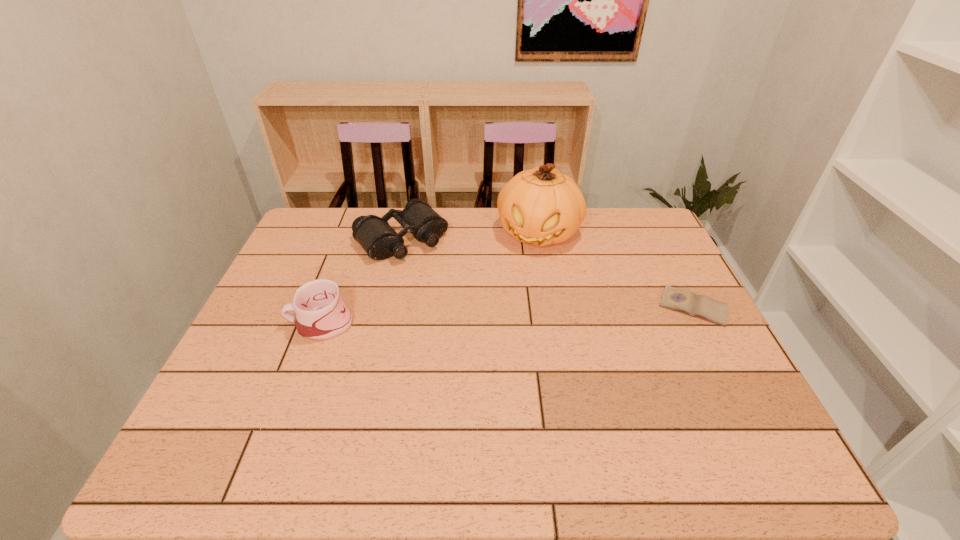
Identify the location of vacant space located on the front face of the pumpkin. (512, 314).

Locate an element on the screen. free space located on the front face of the pumpkin is located at coordinates (525, 272).

Locate an element on the screen. The image size is (960, 540). free space located on the front face of the pumpkin is located at coordinates (525, 272).

Find the location of a particular element. This screenshot has height=540, width=960. binoculars at the far edge is located at coordinates (380, 241).

Identify the location of pumpkin positioned at the far edge. (540, 206).

Find the location of a particular element. This screenshot has width=960, height=540. object positioned at the left edge is located at coordinates (321, 314).

You are a GUI agent. You are given a task and a screenshot of the screen. Output one action in this format:
    pyautogui.click(x=<x>, y=<y>)
    Task: Click on the object positioned at the right edge
    This screenshot has height=540, width=960.
    Given the screenshot: What is the action you would take?
    pyautogui.click(x=686, y=301)

Find the location of a particular element. blank space at the far edge of the desktop is located at coordinates (479, 208).

In the image, there is a desktop. Find the location of `vacant space at the near edge`. vacant space at the near edge is located at coordinates (295, 423).

In order to click on free spot at the left edge of the desktop in this screenshot , I will do `click(276, 326)`.